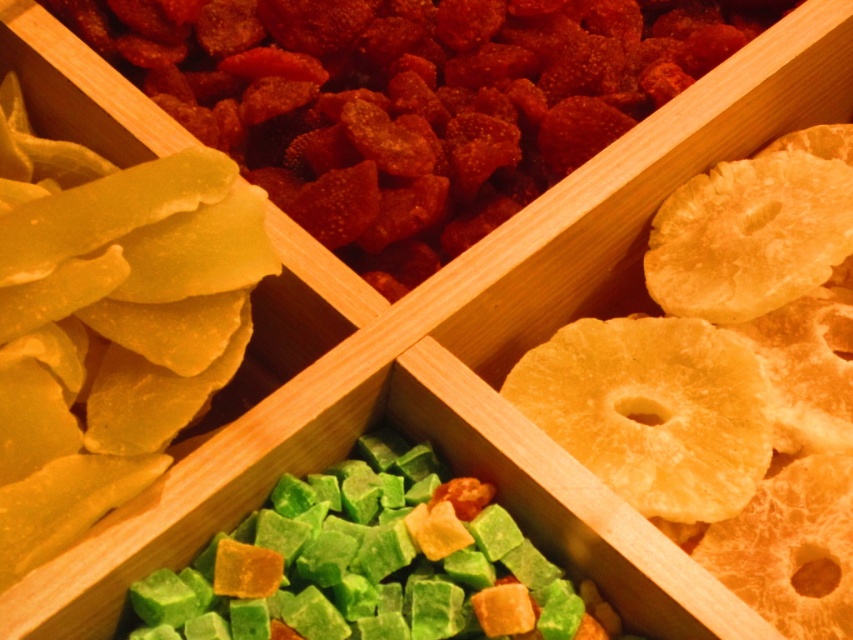
Question: Can you confirm if yellow translucent gummy at upper left is positioned to the right of golden textured pineapple slices at right?

Choices:
 (A) no
 (B) yes

Answer: (A)

Question: Can you confirm if yellow translucent gummy at upper left is wider than golden textured pineapple slices at right?

Choices:
 (A) yes
 (B) no

Answer: (A)

Question: Among these objects, which one is farthest from the camera?

Choices:
 (A) golden textured pineapple slices at right
 (B) yellow translucent gummy at upper left

Answer: (B)

Question: Can you confirm if yellow translucent gummy at upper left is positioned below golden textured pineapple slices at right?

Choices:
 (A) no
 (B) yes

Answer: (A)